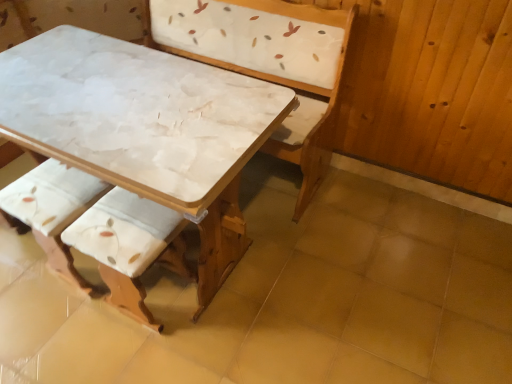
At what (x,y) coordinates should I click in order to perform the action: click on vacant region in front of white fabric cushion at lower left, the 1th armchair from the right. Please return your answer as a coordinate pair (x, y). Looking at the image, I should click on (137, 358).